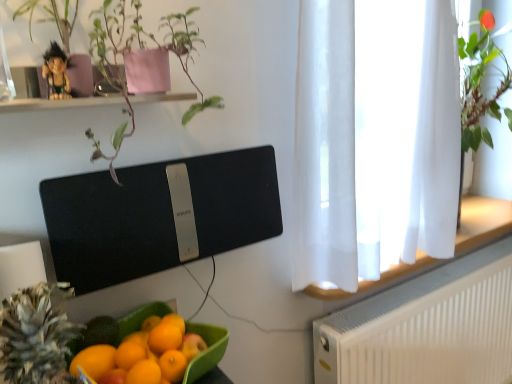
Question: Considering the relative positions of black matte speaker at upper center and white sheer curtain at right in the image provided, is black matte speaker at upper center to the left of white sheer curtain at right from the viewer's perspective?

Choices:
 (A) no
 (B) yes

Answer: (B)

Question: From the image's perspective, is black matte speaker at upper center located beneath white sheer curtain at right?

Choices:
 (A) yes
 (B) no

Answer: (A)

Question: Is black matte speaker at upper center smaller than white sheer curtain at right?

Choices:
 (A) no
 (B) yes

Answer: (B)

Question: Can we say black matte speaker at upper center lies outside white sheer curtain at right?

Choices:
 (A) no
 (B) yes

Answer: (B)

Question: From a real-world perspective, is black matte speaker at upper center located beneath white sheer curtain at right?

Choices:
 (A) no
 (B) yes

Answer: (B)

Question: Is white sheer curtain at right inside or outside of white textured radiator at lower right?

Choices:
 (A) outside
 (B) inside

Answer: (A)

Question: From a real-world perspective, relative to white textured radiator at lower right, is white sheer curtain at right vertically above or below?

Choices:
 (A) below
 (B) above

Answer: (B)

Question: Would you say white sheer curtain at right is to the left or to the right of white textured radiator at lower right in the picture?

Choices:
 (A) left
 (B) right

Answer: (A)

Question: Considering the positions of point (356, 39) and point (472, 279), is point (356, 39) closer or farther from the camera than point (472, 279)?

Choices:
 (A) closer
 (B) farther

Answer: (A)

Question: From their relative heights in the image, would you say black matte speaker at upper center is taller or shorter than white sheer curtain at right?

Choices:
 (A) short
 (B) tall

Answer: (A)

Question: In terms of size, does black matte speaker at upper center appear bigger or smaller than white sheer curtain at right?

Choices:
 (A) big
 (B) small

Answer: (B)

Question: In the image, is black matte speaker at upper center on the left side or the right side of white sheer curtain at right?

Choices:
 (A) right
 (B) left

Answer: (B)

Question: Considering their positions, is black matte speaker at upper center located in front of or behind white sheer curtain at right?

Choices:
 (A) front
 (B) behind

Answer: (A)

Question: Considering their positions, is green textured pineapple at lower left located in front of or behind plastic figurine at upper left?

Choices:
 (A) front
 (B) behind

Answer: (A)

Question: From a real-world perspective, is green textured pineapple at lower left above or below plastic figurine at upper left?

Choices:
 (A) below
 (B) above

Answer: (A)